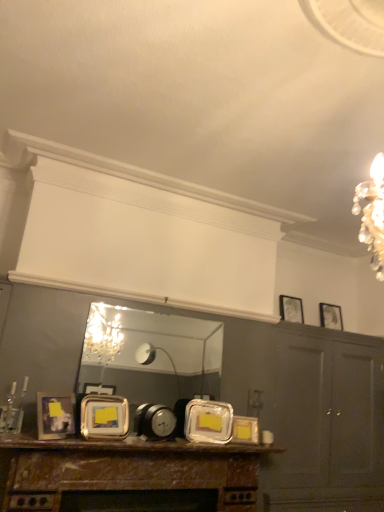
Where is `vacant area in front of metallic silver alarm clock at center`? The height and width of the screenshot is (512, 384). vacant area in front of metallic silver alarm clock at center is located at coordinates (150, 443).